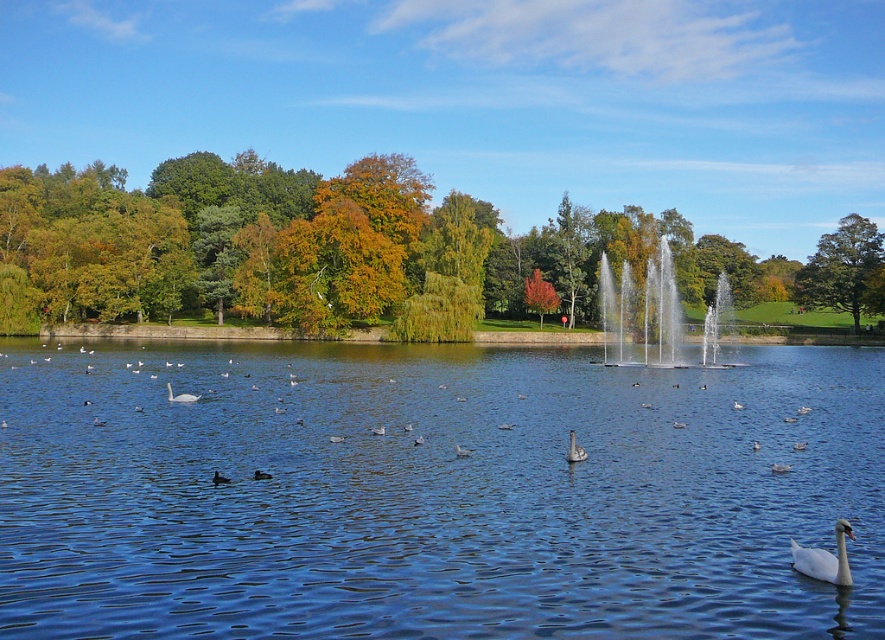
You are standing at the lakeside and want to take a photo of the white glossy swan at center without the orange leafy tree at center blocking the view. Is there a way to position yourself so that the swan is visible without the tree obstructing it?

The white glossy swan at center is behind the orange leafy tree at center, so you would need to move to a position where the tree is not between you and the swan. Moving to the right side of the frame, where the swan is swimming towards, might allow you to see the swan without the tree blocking the view.

You are a photographer trying to capture both the white matte goose at center and the white glossy swan at center in a single shot. Given their potential size difference, which one might require you to adjust your camera angle to ensure they both fit in the frame?

The white matte goose at center might be wider than the white glossy swan at center, so you may need to adjust your camera angle to accommodate its width to ensure both fit in the frame.

You are standing at the lakeside and want to take a photo of the orange leafy tree at center. If your camera has a maximum zoom range of 100 meters, will you be able to capture the tree clearly without moving closer?

The orange leafy tree at center is 95.77 meters away from the viewer. Since the camera can zoom up to 100 meters, you can capture the tree clearly without moving closer.